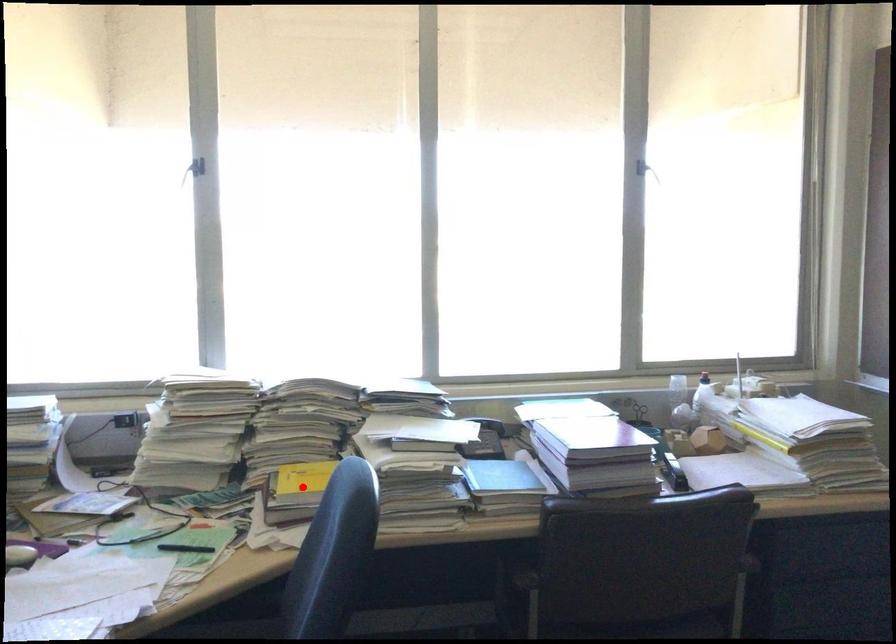
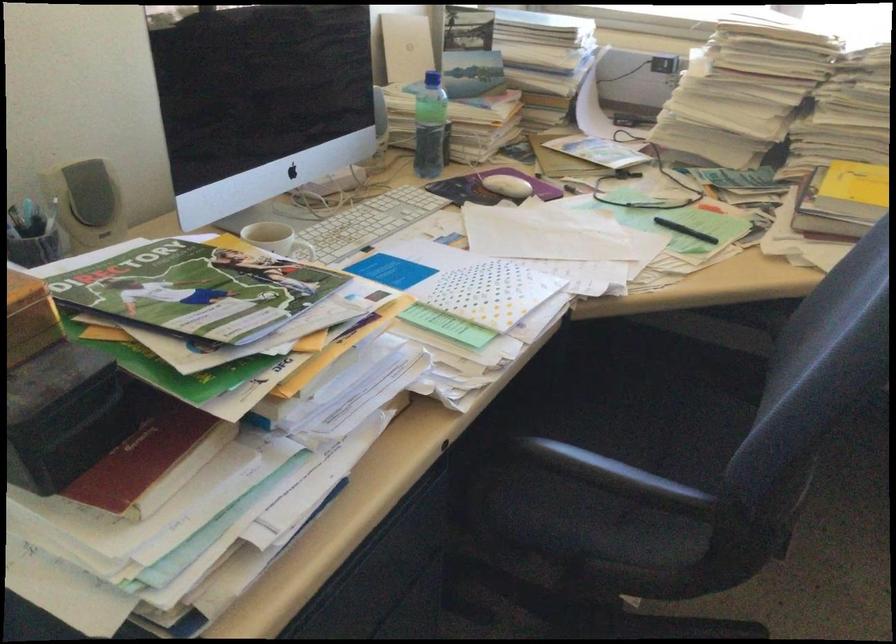
The point at the highlighted location is marked in the first image. Where is the corresponding point in the second image?

(853, 194)